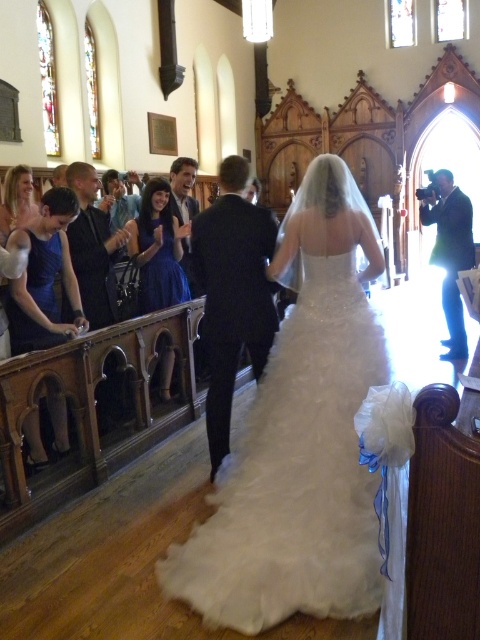
Question: Which object is closer to the camera taking this photo?

Choices:
 (A) satin blue dress at center
 (B) matte black camera at right
 (C) white tulle dress at center

Answer: (C)

Question: Does white tulle dress at center have a larger size compared to dark suit at center?

Choices:
 (A) no
 (B) yes

Answer: (B)

Question: Among these objects, which one is farthest from the camera?

Choices:
 (A) dark gray suit at center
 (B) matte black suit at center
 (C) satin blue dress at center

Answer: (B)

Question: Is the position of dark suit at center more distant than that of matte black camera at right?

Choices:
 (A) yes
 (B) no

Answer: (B)

Question: Considering the relative positions of white tulle dress at center and matte black camera at right in the image provided, where is white tulle dress at center located with respect to matte black camera at right?

Choices:
 (A) right
 (B) left

Answer: (B)

Question: Which object is farther from the camera taking this photo?

Choices:
 (A) dark gray suit at center
 (B) white tulle dress at center
 (C) satin blue dress at center

Answer: (C)